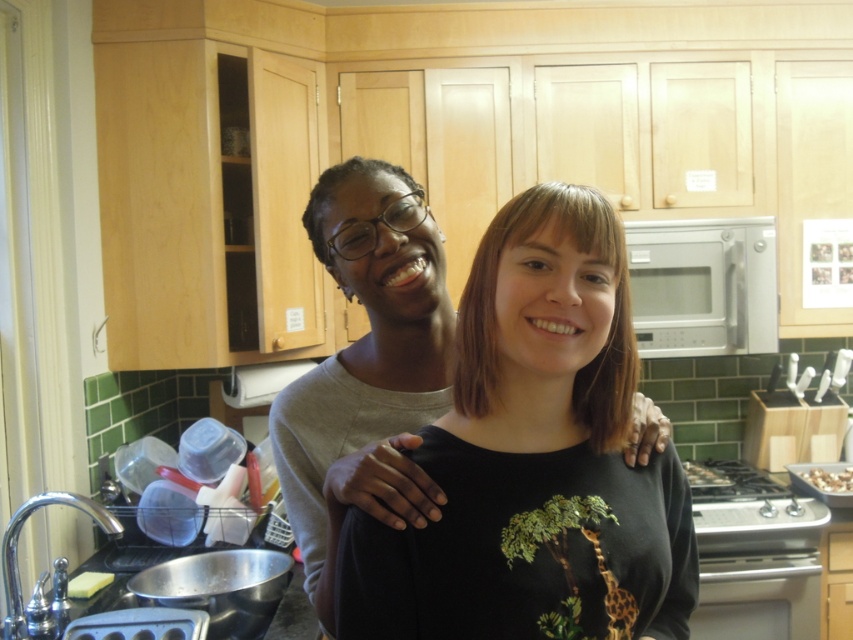
Question: Which is nearer to the shiny silver tray at stove right?

Choices:
 (A) satin silver microwave at right
 (B) shiny chocolate bar at right

Answer: (B)

Question: Considering the real-world distances, which object is closest to the shiny chocolate bar at right?

Choices:
 (A) shiny silver tray at stove right
 (B) matte gray sweater at center
 (C) satin silver microwave at right

Answer: (A)

Question: Can you confirm if matte gray sweater at center is smaller than shiny chocolate bar at right?

Choices:
 (A) no
 (B) yes

Answer: (A)

Question: Is shiny chocolate bar at right wider than shiny silver tray at stove right?

Choices:
 (A) yes
 (B) no

Answer: (B)

Question: Which point is closer to the camera taking this photo?

Choices:
 (A) (833, 474)
 (B) (689, 292)

Answer: (B)

Question: Observing the image, what is the correct spatial positioning of satin silver microwave at right in reference to shiny chocolate bar at right?

Choices:
 (A) left
 (B) right

Answer: (A)